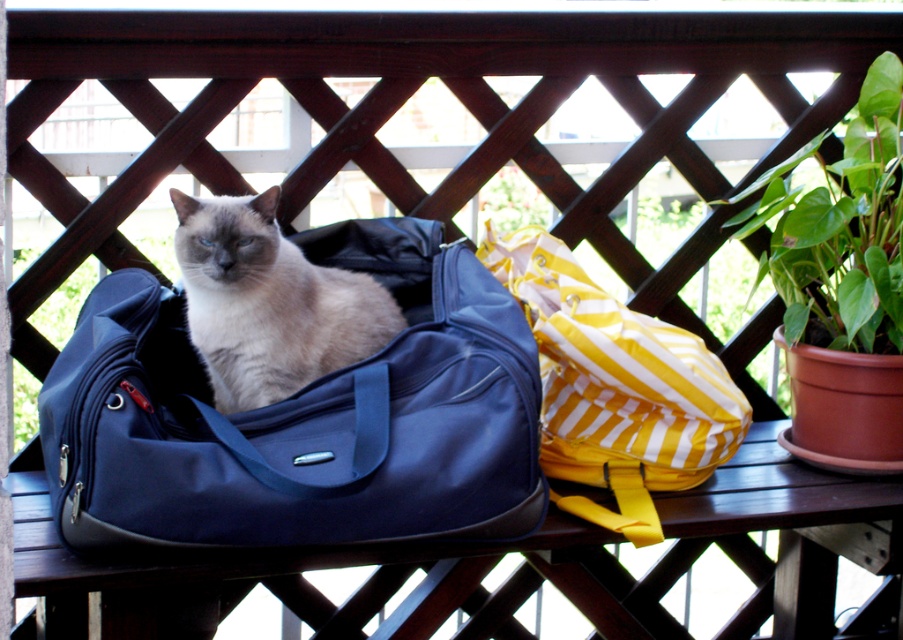
Question: Which point is farther from the camera taking this photo?

Choices:
 (A) (175, 234)
 (B) (63, 324)
 (C) (842, 182)

Answer: (B)

Question: Estimate the real-world distances between objects in this image. Which object is farther from the green glossy leaf at upper right?

Choices:
 (A) yellow striped backpack at right
 (B) smokey gray fur at center

Answer: (B)

Question: Which object is closer to the camera taking this photo?

Choices:
 (A) green glossy leaf at upper right
 (B) yellow striped backpack at right

Answer: (B)

Question: Is smokey gray fur at center closer to the viewer compared to green leafy plant at upper left?

Choices:
 (A) no
 (B) yes

Answer: (B)

Question: Does smokey gray fur at center appear on the right side of green leafy plant at upper left?

Choices:
 (A) yes
 (B) no

Answer: (A)

Question: Can you confirm if yellow striped backpack at right is smaller than green glossy leaf at upper right?

Choices:
 (A) no
 (B) yes

Answer: (B)